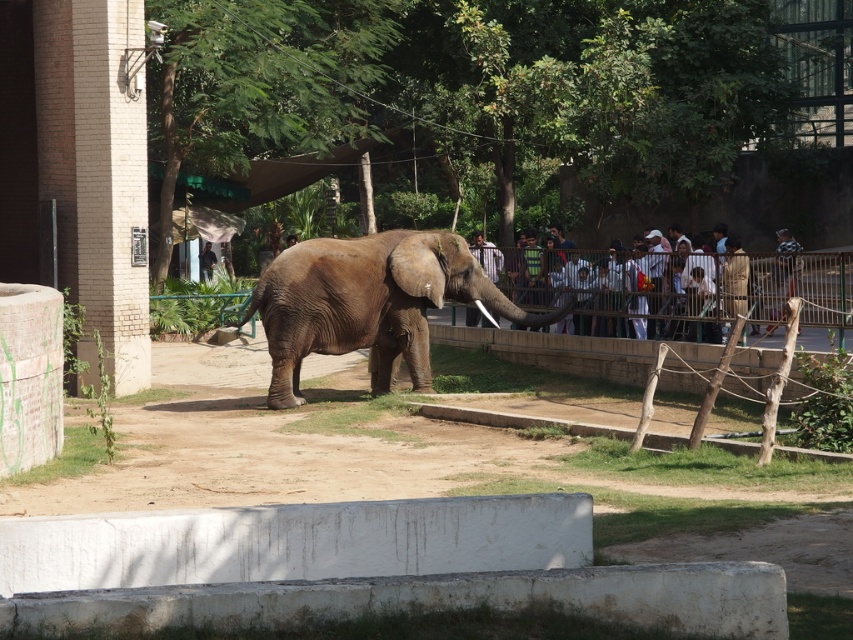
You are a zookeeper who needs to guide the brown textured elephant at center to a feeding area. You notice the light brown fabric shirt at center in the distance. Which object is closer to the ground?

The brown textured elephant at center is closer to the ground because it is below the light brown fabric shirt at center.

You are a zookeeper who needs to determine if a new camera mounted at the center can capture both the brown textured elephant at center and the dark brown leather jacket at center. Since the camera has a fixed height, will the elephant block the view of the jacket?

The brown textured elephant at center is taller than the dark brown leather jacket at center, so the elephant will block the view of the jacket from the camera mounted at the center.